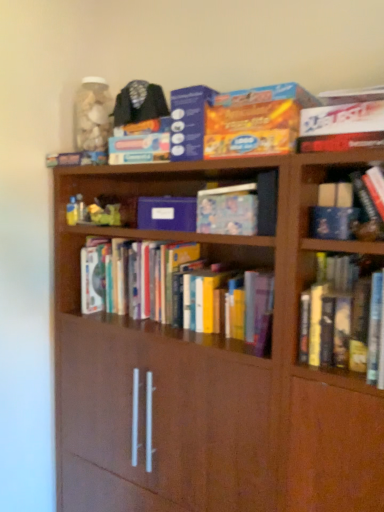
Question: Considering the relative positions of matte cardboard box at upper center, positioned as the 3th paperback book in bottom-to-top order, and blue matte paper at center, the 1th paperback book positioned from the bottom, in the image provided, is matte cardboard box at upper center, positioned as the 3th paperback book in bottom-to-top order, to the left of blue matte paper at center, the 1th paperback book positioned from the bottom, from the viewer's perspective?

Choices:
 (A) no
 (B) yes

Answer: (A)

Question: Would you say matte cardboard box at upper center, positioned as the 3th paperback book in bottom-to-top order, is outside blue matte paper at center, which is the 3th paperback book from top to bottom?

Choices:
 (A) no
 (B) yes

Answer: (B)

Question: Can you confirm if matte cardboard box at upper center, positioned as the 3th paperback book in bottom-to-top order, is bigger than blue matte paper at center, the 1th paperback book positioned from the bottom?

Choices:
 (A) yes
 (B) no

Answer: (A)

Question: Is matte cardboard box at upper center, positioned as the 3th paperback book in bottom-to-top order, at the right side of blue matte paper at center, which is the 3th paperback book from top to bottom?

Choices:
 (A) no
 (B) yes

Answer: (B)

Question: Can you confirm if matte cardboard box at upper center, positioned as the 3th paperback book in bottom-to-top order, is shorter than blue matte paper at center, the 1th paperback book positioned from the bottom?

Choices:
 (A) yes
 (B) no

Answer: (B)

Question: In terms of height, does matte blue book at center, the first book in the top-to-bottom sequence, look taller or shorter compared to matte cardboard box at upper center, positioned as the 3th paperback book in bottom-to-top order?

Choices:
 (A) tall
 (B) short

Answer: (B)

Question: Is matte blue book at center, the first book in the top-to-bottom sequence, inside or outside of matte cardboard box at upper center, positioned as the 3th paperback book in bottom-to-top order?

Choices:
 (A) inside
 (B) outside

Answer: (B)

Question: From a real-world perspective, is matte blue book at center, the first book in the top-to-bottom sequence, above or below matte cardboard box at upper center, which appears as the first paperback book when viewed from the top?

Choices:
 (A) above
 (B) below

Answer: (B)

Question: Looking at their shapes, would you say matte blue book at center, the first book in the top-to-bottom sequence, is wider or thinner than matte cardboard box at upper center, positioned as the 3th paperback book in bottom-to-top order?

Choices:
 (A) thin
 (B) wide

Answer: (A)

Question: Is matte blue book at center, the first book in the top-to-bottom sequence, bigger or smaller than hardcover books at center, placed as the 1th book when sorted from bottom to top?

Choices:
 (A) small
 (B) big

Answer: (A)

Question: Considering the positions of matte blue book at center, the 2th book in the bottom-to-top sequence, and hardcover books at center, placed as the 1th book when sorted from bottom to top, in the image, is matte blue book at center, the 2th book in the bottom-to-top sequence, wider or thinner than hardcover books at center, placed as the 1th book when sorted from bottom to top,?

Choices:
 (A) thin
 (B) wide

Answer: (A)

Question: Considering their positions, is matte blue book at center, the 2th book in the bottom-to-top sequence, located in front of or behind hardcover books at center, placed as the 1th book when sorted from bottom to top?

Choices:
 (A) front
 (B) behind

Answer: (A)

Question: From the image's perspective, is matte blue book at center, the first book in the top-to-bottom sequence, located above or below hardcover books at center, acting as the second book starting from the top?

Choices:
 (A) below
 (B) above

Answer: (B)

Question: Looking at their shapes, would you say matte cardboard box at upper center, which appears as the first paperback book when viewed from the top, is wider or thinner than matte blue book at center, the 2th book in the bottom-to-top sequence?

Choices:
 (A) thin
 (B) wide

Answer: (B)

Question: From the image's perspective, relative to matte blue book at center, the 2th book in the bottom-to-top sequence, is matte cardboard box at upper center, which appears as the first paperback book when viewed from the top, above or below?

Choices:
 (A) above
 (B) below

Answer: (A)